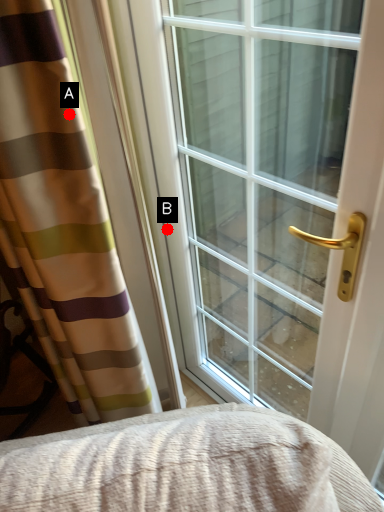
Question: Two points are circled on the image, labeled by A and B beside each circle. Which point appears farthest from the camera in this image?

Choices:
 (A) A is further
 (B) B is further

Answer: (B)